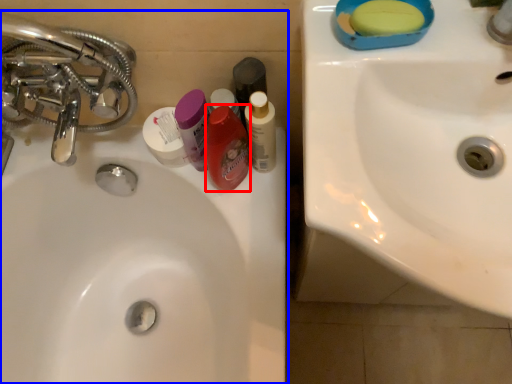
Question: Which point is further to the camera, mouthwash (highlighted by a red box) or sink (highlighted by a blue box)?

Choices:
 (A) mouthwash
 (B) sink

Answer: (B)